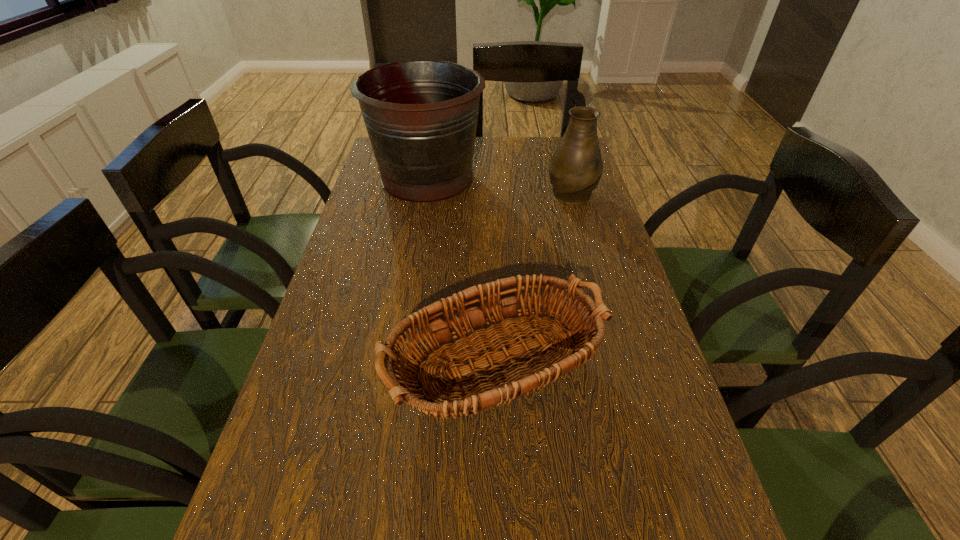
Locate which object is the closest to the second shortest object. Please provide its 2D coordinates. Your answer should be formatted as a tuple, i.e. [(x, y)], where the tuple contains the x and y coordinates of a point satisfying the conditions above.

[(421, 116)]